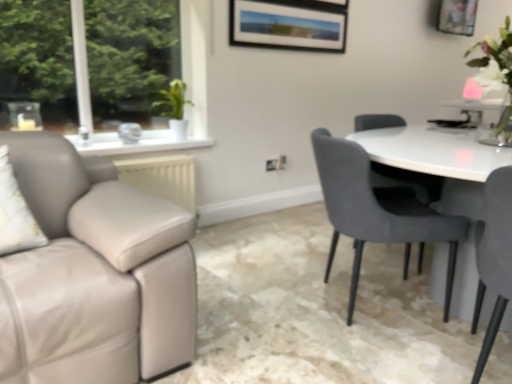
The image size is (512, 384). I want to click on free area in between velvet grey chair at right, which is the 2th chair from front to back, and matte gray chair at right, which is the first chair from front to back, so click(403, 350).